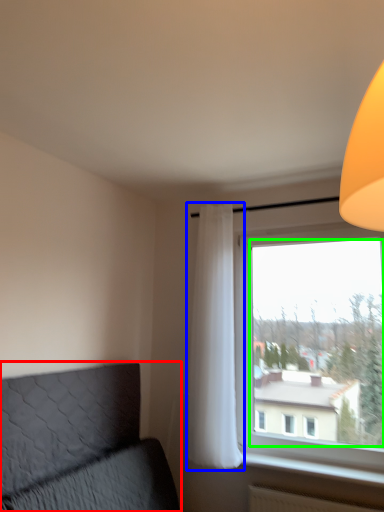
Question: Based on their relative distances, which object is farther from furniture (highlighted by a red box)? Choose from curtain (highlighted by a blue box) and window screen (highlighted by a green box).

Choices:
 (A) curtain
 (B) window screen

Answer: (B)